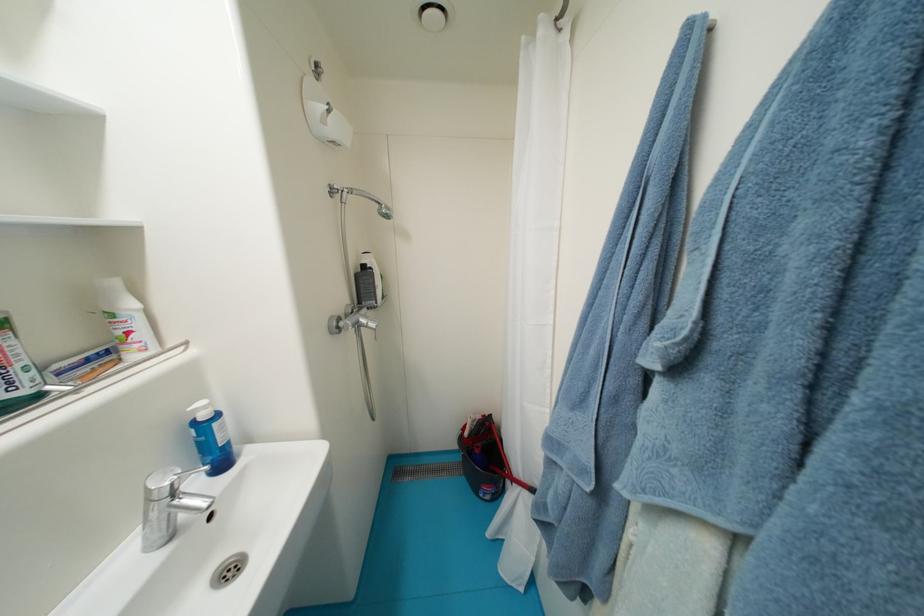
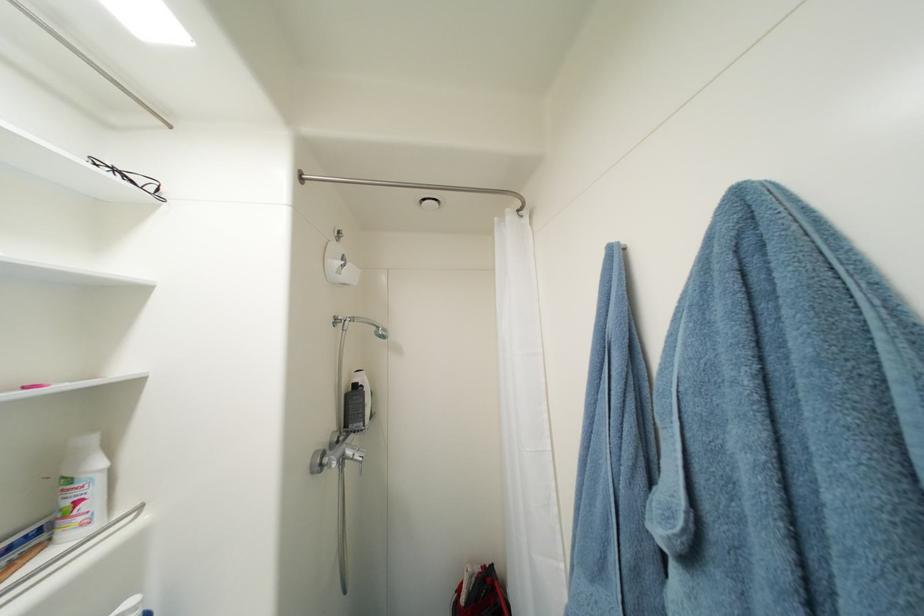
Locate, in the second image, the point that corresponds to pixel 371 269 in the first image.

(361, 387)